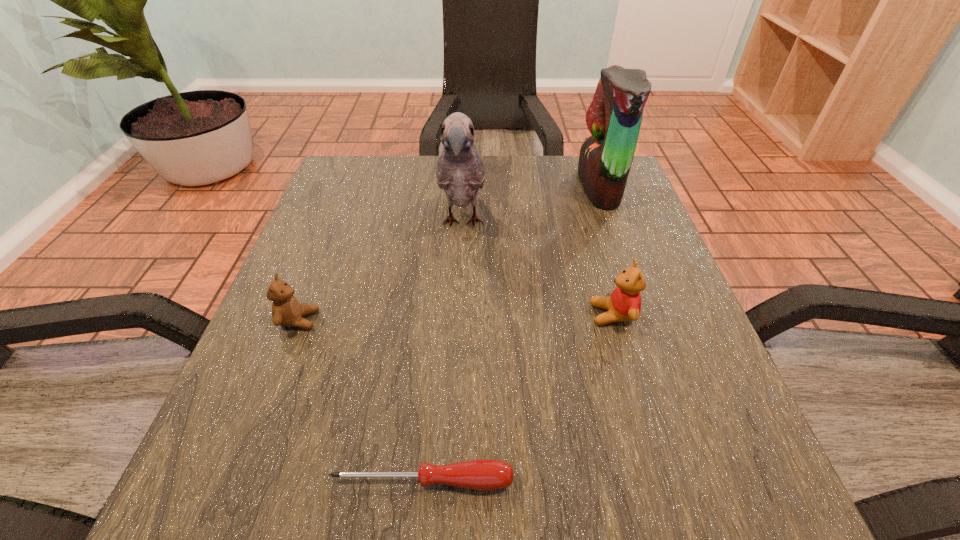
The image size is (960, 540). In order to click on free space that satisfies the following two spatial constraints: 1. on the front-facing side of the left parrot; 2. on the front-facing side of the left teddy bear in this screenshot , I will do point(458,320).

This screenshot has height=540, width=960. Identify the location of free space that satisfies the following two spatial constraints: 1. on the front-facing side of the shortest object; 2. on the left side of the leftmost object. (237, 481).

Where is `free space that satisfies the following two spatial constraints: 1. on the front-facing side of the right teddy bear; 2. on the front side of the nearest object`? This screenshot has height=540, width=960. free space that satisfies the following two spatial constraints: 1. on the front-facing side of the right teddy bear; 2. on the front side of the nearest object is located at coordinates (660, 481).

Find the location of `vacant region that satisfies the following two spatial constraints: 1. at the face of the right parrot; 2. on the front-facing side of the left parrot`. vacant region that satisfies the following two spatial constraints: 1. at the face of the right parrot; 2. on the front-facing side of the left parrot is located at coordinates (612, 223).

Identify the location of vacant space that satisfies the following two spatial constraints: 1. at the face of the right parrot; 2. on the front-facing side of the left parrot. (612, 223).